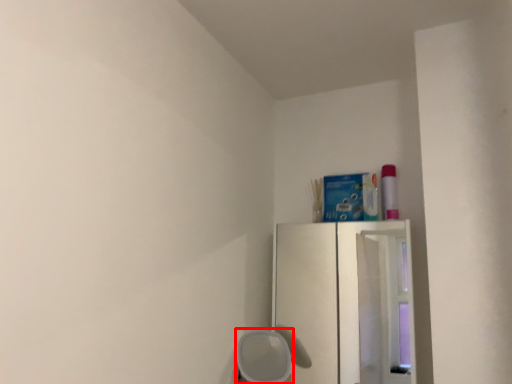
Question: From the image, what is the correct spatial relationship of furniture (annotated by the red box) in relation to fridge?

Choices:
 (A) right
 (B) left

Answer: (B)